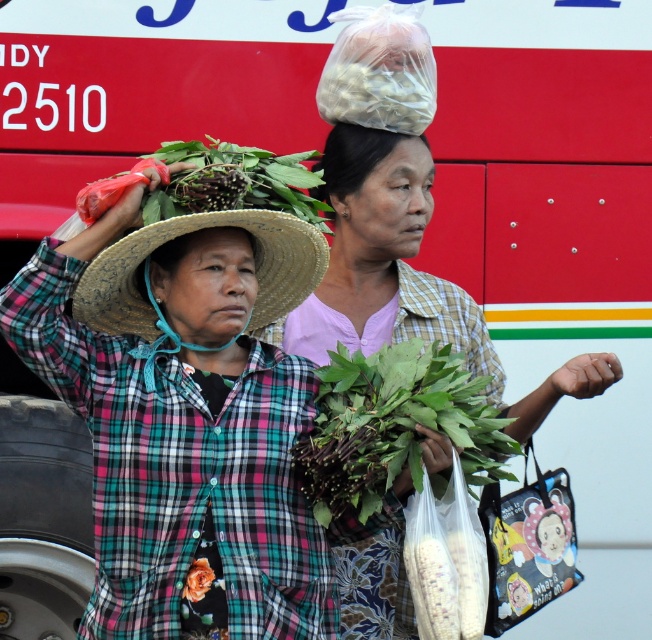
Consider the image. Who is lower down, green leafy bundle at center or orange fabric flower at lower left?

orange fabric flower at lower left

Between point (550, 376) and point (198, 598), which one is positioned in front?

Point (198, 598) is more forward.

Is point (379, 150) positioned before point (203, 595)?

No, (379, 150) is behind (203, 595).

Identify the location of green leafy bundle at center. (406, 275).

In order to click on green leafy plant at center in this screenshot , I will do `click(393, 426)`.

Between green leafy plant at center and straw hat at center, which one has more height?

Standing taller between the two is green leafy plant at center.

Identify the location of green leafy plant at center. The height and width of the screenshot is (640, 652). (393, 426).

Identify the location of green leafy plant at center. The width and height of the screenshot is (652, 640). (393, 426).

Which is more to the right, green leafy plant at center or orange fabric flower at lower left?

From the viewer's perspective, green leafy plant at center appears more on the right side.

Does point (417, 392) come farther from viewer compared to point (209, 572)?

No, (417, 392) is closer to viewer.

Locate an element on the screen. green leafy plant at center is located at coordinates (393, 426).